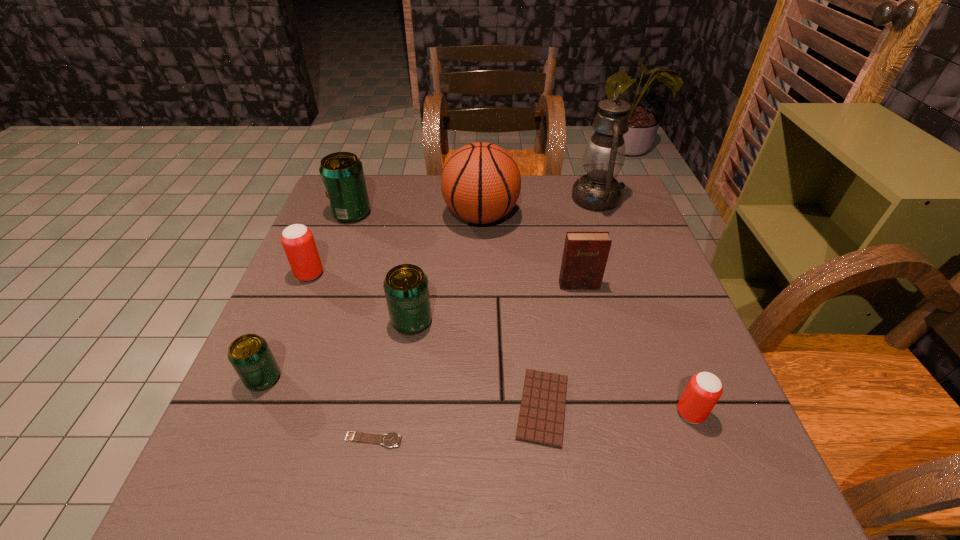
In order to click on the rightmost beer can in this screenshot , I will do `click(703, 391)`.

The width and height of the screenshot is (960, 540). I want to click on the right red beer can, so [x=703, y=391].

You are a GUI agent. You are given a task and a screenshot of the screen. Output one action in this format:
    pyautogui.click(x=<x>, y=<y>)
    Task: Click on the fourth farthest beer can
    This screenshot has height=540, width=960.
    Given the screenshot: What is the action you would take?
    pyautogui.click(x=249, y=354)

Identify the location of the smallest green beer can. This screenshot has width=960, height=540. (249, 354).

At what (x,y) coordinates should I click in order to perform the action: click on brown chocolate bar. Please return your answer as a coordinate pair (x, y). Looking at the image, I should click on (541, 418).

Locate an element on the screen. the second shortest object is located at coordinates (541, 418).

The height and width of the screenshot is (540, 960). Find the location of `watch`. watch is located at coordinates (390, 440).

The width and height of the screenshot is (960, 540). In order to click on free spot located 0.220m on the front of the tallest object in this screenshot , I will do `click(622, 271)`.

The width and height of the screenshot is (960, 540). Identify the location of free space located on the side where the inflation valve is located. (400, 217).

Identify the location of blank space located on the side where the inflation valve is located. This screenshot has height=540, width=960. (372, 217).